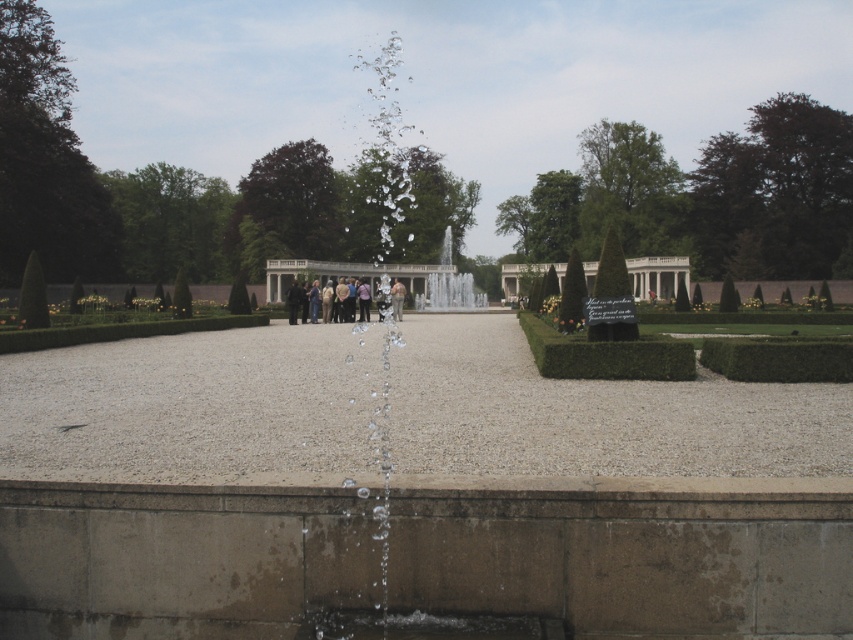
You are planning to place a small bench in the garden. The bench requires a clear space of 1 meter in front of it. Given the positions of the green hedge at lower right and the white stone palace at center, where should you place the bench to ensure it doesn

The green hedge at lower right is positioned under the white stone palace at center, so placing the bench in an area away from both structures would provide the necessary clear space of 1 meter in front of it.

In the scene shown: You are standing at the camera position in the garden scene. There is a point marked at coordinates point (769, 368). Can you reach this point without moving more than 15 meters forward?

The point (769, 368) is 15.45 meters away from the camera, so moving forward 15 meters would not be enough to reach it. You need to move at least 15.45 meters forward.

You are planning to install a new lighting system in the garden. The green hedge at lower right and the clear glass water at center are key features. Which object requires taller light fixtures to fully illuminate its height?

The clear glass water at center requires taller light fixtures because it has a greater height than the green hedge at lower right.